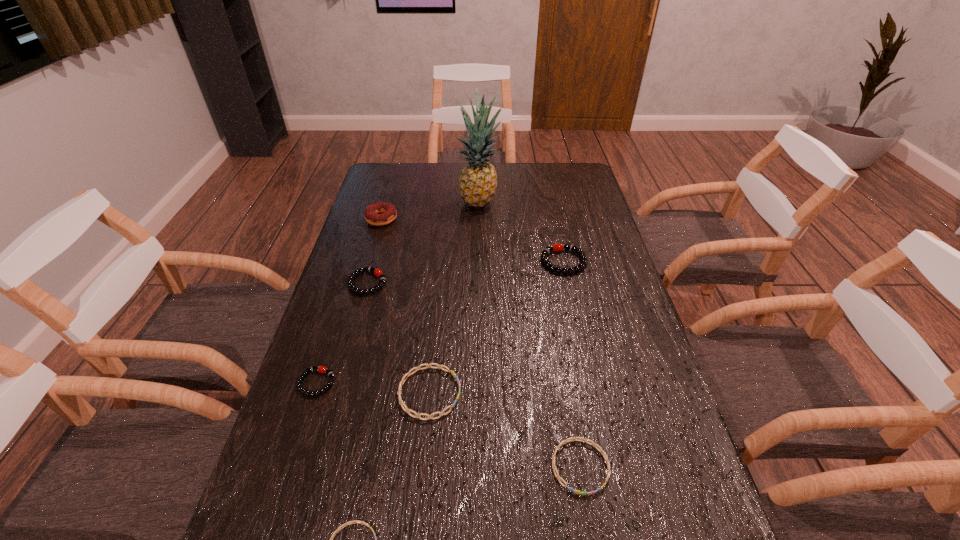
Where is `vacant point located between the smallest black bracelet and the farthest blue bracelet`? vacant point located between the smallest black bracelet and the farthest blue bracelet is located at coordinates (373, 388).

Where is `free spot between the doughnut and the rightmost black bracelet`? This screenshot has height=540, width=960. free spot between the doughnut and the rightmost black bracelet is located at coordinates (472, 240).

This screenshot has width=960, height=540. Find the location of `vacant area that lies between the rightmost black bracelet and the second smallest black bracelet`. vacant area that lies between the rightmost black bracelet and the second smallest black bracelet is located at coordinates (466, 272).

The image size is (960, 540). I want to click on free spot between the doughnut and the second biggest black bracelet, so click(374, 251).

Locate an element on the screen. The image size is (960, 540). the third closest object to the biggest blue bracelet is located at coordinates (354, 521).

Find the location of a particular element. This screenshot has height=540, width=960. the fifth closest object to the yellow pineapple is located at coordinates (321, 369).

In order to click on bracelet that stands as the fifth closest to the biggest black bracelet in this screenshot , I will do `click(354, 521)`.

Where is `bracelet that is the second nearest to the second biggest black bracelet`? bracelet that is the second nearest to the second biggest black bracelet is located at coordinates (408, 374).

This screenshot has width=960, height=540. What are the coordinates of `black bracelet that can be found as the closest to the smallest black bracelet` in the screenshot? It's located at (377, 272).

What are the coordinates of `black bracelet that can be found as the closest to the second smallest blue bracelet` in the screenshot? It's located at (321, 369).